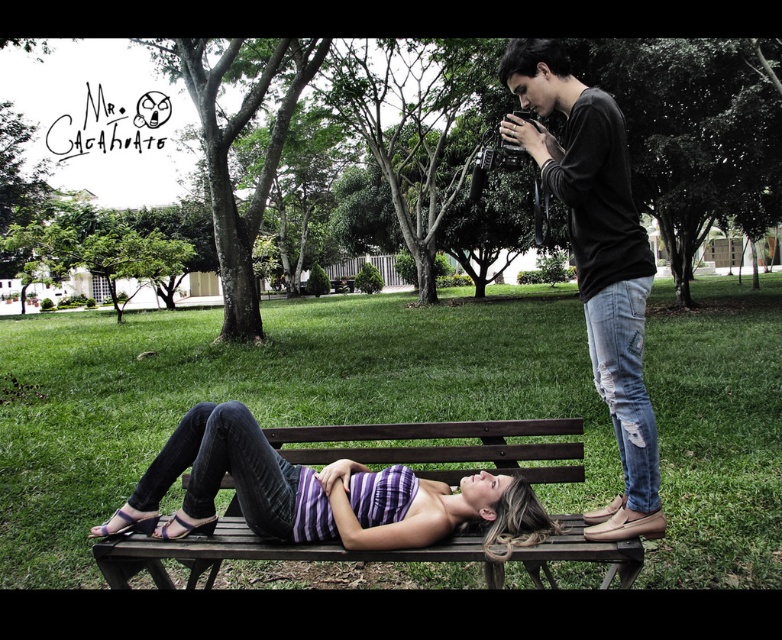
You are a photographer setting up for a photoshoot in the park. You have two outfits to choose from for the model. The first is the purple striped tank top at center, and the second is the black cotton shirt at upper right. The model wants to wear the wider garment. Which outfit should she choose?

The purple striped tank top at center is wider than the black cotton shirt at upper right, so the model should choose the purple striped tank top at center.

You are a photographer trying to capture both the purple striped tank top at center and the black cotton shirt at upper right in a single shot. Which clothing item will appear larger in the photo?

The purple striped tank top at center will appear larger in the photo because it is closer to the viewer than the black cotton shirt at upper right.

You are a photographer setting up for a photoshoot in the park. You need to place a small prop exactly where the purple striped tank top at center is currently located. What are the coordinates where you should place the prop?

The coordinates for the purple striped tank top at center are at point (318, 493), so you should place the prop there.